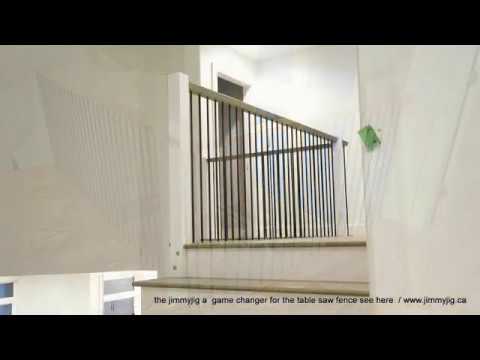
The width and height of the screenshot is (480, 360). I want to click on lower window pain below narrow top one, so click(123, 306), click(5, 304).